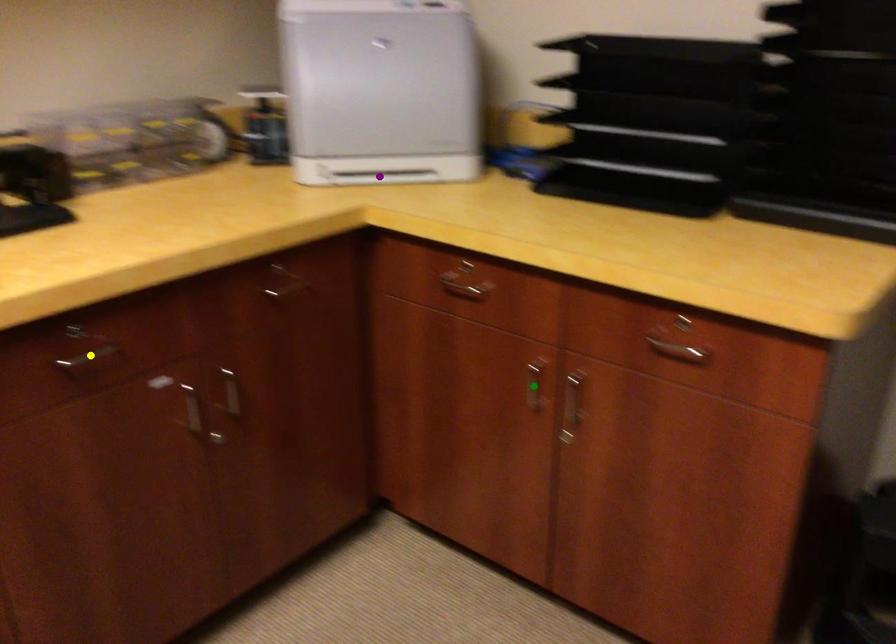
Order these from farthest to nearest:
1. purple point
2. yellow point
3. green point

A: 1. purple point
2. green point
3. yellow point